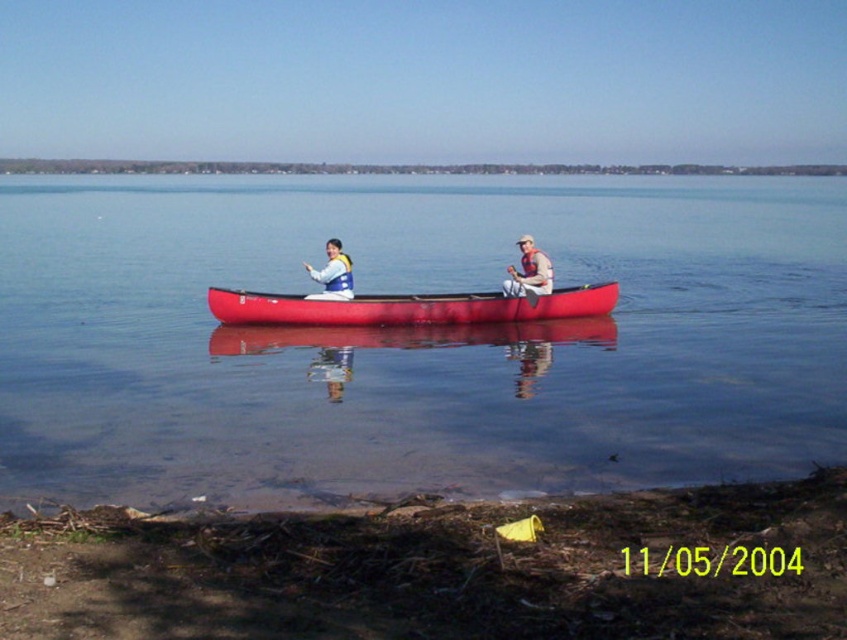
Can you confirm if brown dirt shore at lower left is positioned to the left of white life vest at center?

No, brown dirt shore at lower left is not to the left of white life vest at center.

Between brown dirt shore at lower left and white life vest at center, which one is positioned higher?

white life vest at center

Does point (735, 561) lie in front of point (325, 282)?

Yes.

Identify the location of brown dirt shore at lower left. (441, 570).

Can you confirm if transparent water at center is positioned to the left of white life vest at center?

No, transparent water at center is not to the left of white life vest at center.

Looking at this image, can you confirm if transparent water at center is positioned above white life vest at center?

Yes.

Image resolution: width=847 pixels, height=640 pixels. I want to click on transparent water at center, so click(x=414, y=337).

Is transparent water at center thinner than smooth red canoe at center?

No, transparent water at center is not thinner than smooth red canoe at center.

Is transparent water at center bigger than smooth red canoe at center?

Yes, transparent water at center is bigger than smooth red canoe at center.

Does point (176, 355) lie in front of point (220, 310)?

Yes, point (176, 355) is in front of point (220, 310).

The image size is (847, 640). Find the location of `transparent water at center`. transparent water at center is located at coordinates 414,337.